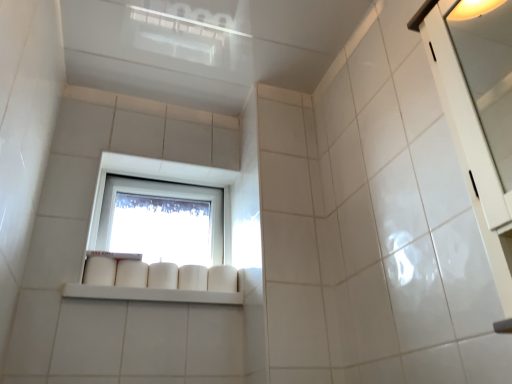
Question: Would you say transparent glass window at center is part of white glossy cabinet at right's contents?

Choices:
 (A) yes
 (B) no

Answer: (B)

Question: From a real-world perspective, is white glossy cabinet at right beneath transparent glass window at center?

Choices:
 (A) yes
 (B) no

Answer: (A)

Question: Can you confirm if white glossy cabinet at right is positioned to the right of transparent glass window at center?

Choices:
 (A) no
 (B) yes

Answer: (B)

Question: Is there a large distance between white glossy cabinet at right and transparent glass window at center?

Choices:
 (A) no
 (B) yes

Answer: (B)

Question: From the image's perspective, is white glossy cabinet at right over transparent glass window at center?

Choices:
 (A) no
 (B) yes

Answer: (B)

Question: Is white glossy cabinet at right thinner than transparent glass window at center?

Choices:
 (A) no
 (B) yes

Answer: (A)

Question: Is white glossy shelf at center oriented towards white glossy cabinet at right?

Choices:
 (A) yes
 (B) no

Answer: (B)

Question: Is white glossy shelf at center positioned behind white glossy cabinet at right?

Choices:
 (A) yes
 (B) no

Answer: (A)

Question: Could white glossy cabinet at right be considered to be inside white glossy shelf at center?

Choices:
 (A) no
 (B) yes

Answer: (A)

Question: Is white glossy shelf at center far from white glossy cabinet at right?

Choices:
 (A) no
 (B) yes

Answer: (B)

Question: Does white glossy shelf at center have a lesser height compared to white glossy cabinet at right?

Choices:
 (A) yes
 (B) no

Answer: (A)

Question: From a real-world perspective, is white glossy shelf at center positioned under white glossy cabinet at right based on gravity?

Choices:
 (A) no
 (B) yes

Answer: (B)

Question: Is white glossy shelf at center not near transparent glass window at center?

Choices:
 (A) no
 (B) yes

Answer: (A)